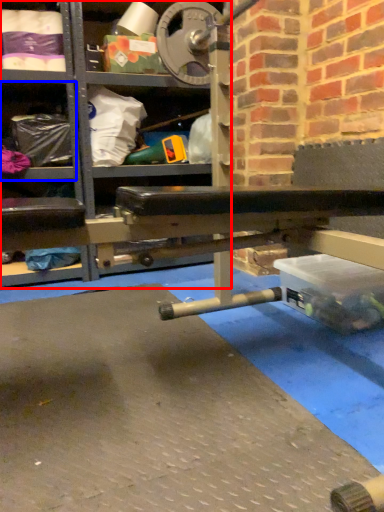
Question: Which of the following is the closest to the observer, shelf (highlighted by a red box) or shelf (highlighted by a blue box)?

Choices:
 (A) shelf
 (B) shelf

Answer: (A)